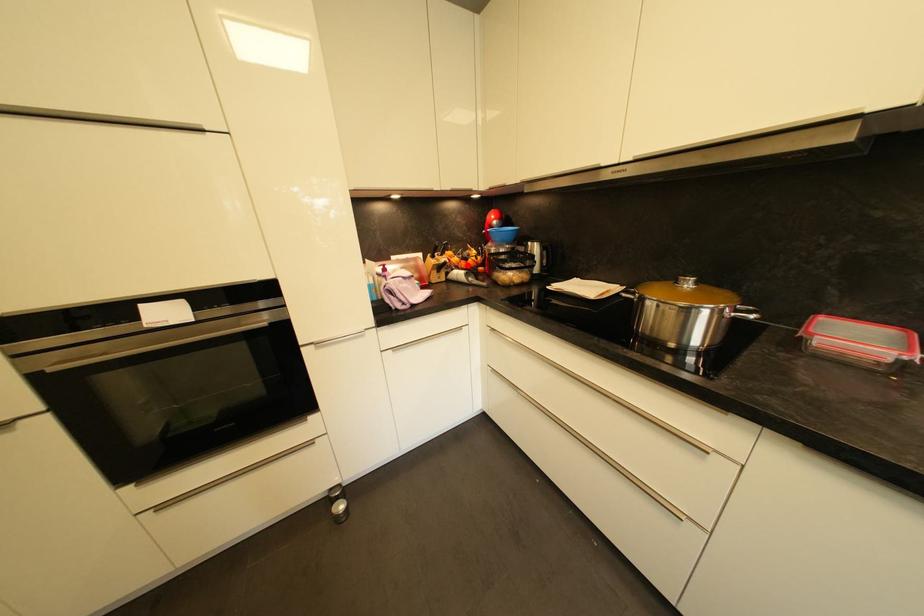
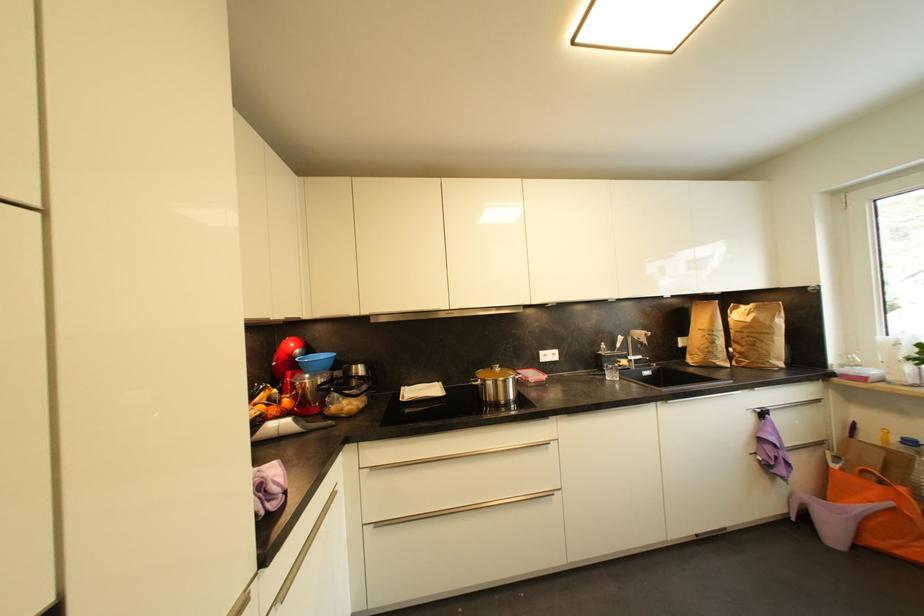
Find the pixel in the second image that matches the highlighted location in the first image.

(277, 411)